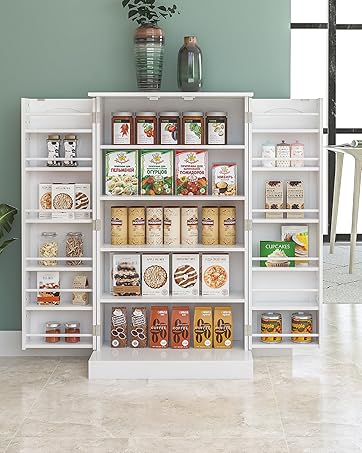
This screenshot has height=453, width=362. What are the coordinates of `round cylinders for food (like a pringles shaped can)` in the screenshot? It's located at (115, 232), (134, 231), (155, 229), (172, 231), (188, 232), (207, 233), (228, 234).